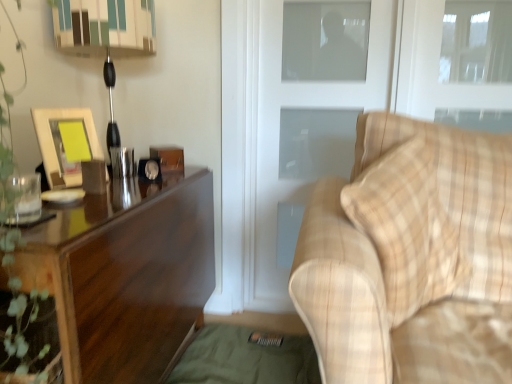
Question: Considering the positions of white frosted glass screen door at center and matte wooden picture frame at left in the image, is white frosted glass screen door at center wider or thinner than matte wooden picture frame at left?

Choices:
 (A) wide
 (B) thin

Answer: (B)

Question: From their relative heights in the image, would you say white frosted glass screen door at center is taller or shorter than matte wooden picture frame at left?

Choices:
 (A) short
 (B) tall

Answer: (B)

Question: Estimate the real-world distances between objects in this image. Which object is farther from the dark wood desk at left?

Choices:
 (A) white frosted glass screen door at center
 (B) matte wooden picture frame at left
 (C) transparent glass window at upper right
 (D) metallic black table lamp at left
 (E) plaid fabric couch at right

Answer: (C)

Question: Which is farther from the white frosted glass screen door at center?

Choices:
 (A) transparent glass window at upper right
 (B) metallic black table lamp at left
 (C) matte wooden picture frame at left
 (D) plaid fabric couch at right
 (E) dark wood desk at left

Answer: (C)